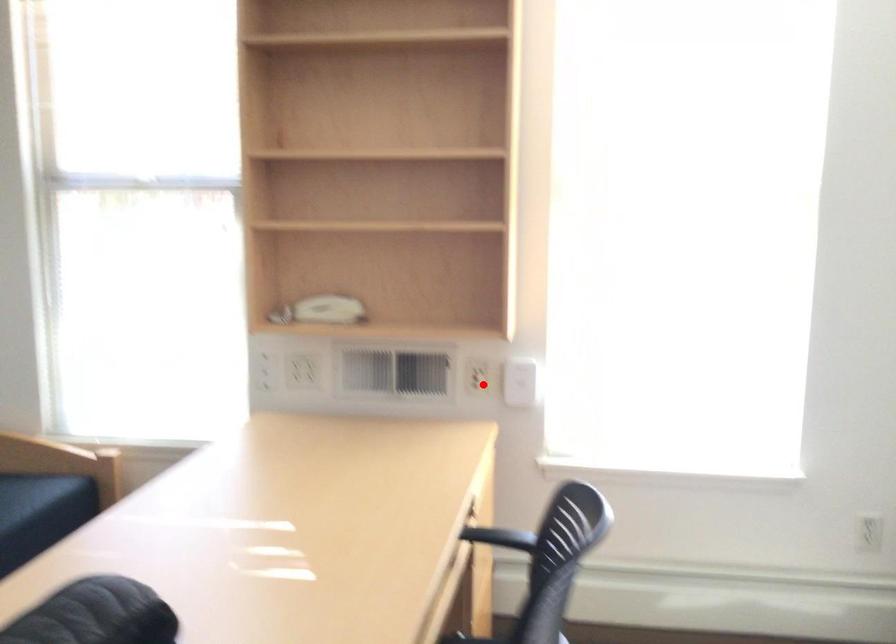
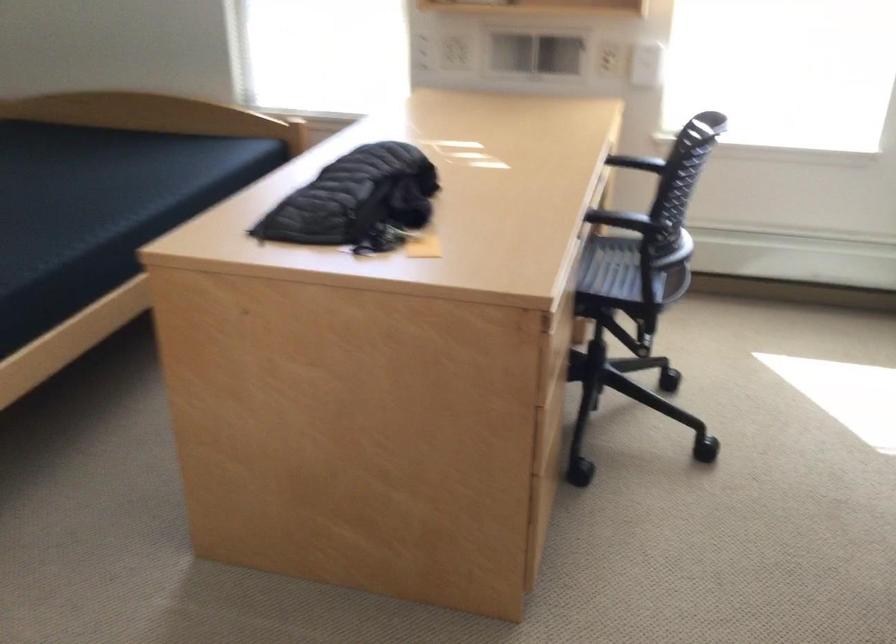
The point at the highlighted location is marked in the first image. Where is the corresponding point in the second image?

(616, 62)